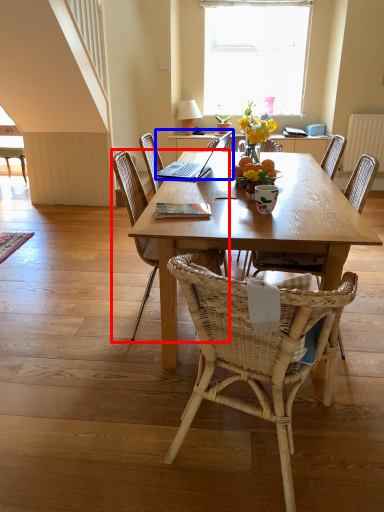
Question: Which point is further to the camera, chair (highlighted by a red box) or laptop (highlighted by a blue box)?

Choices:
 (A) chair
 (B) laptop

Answer: (B)